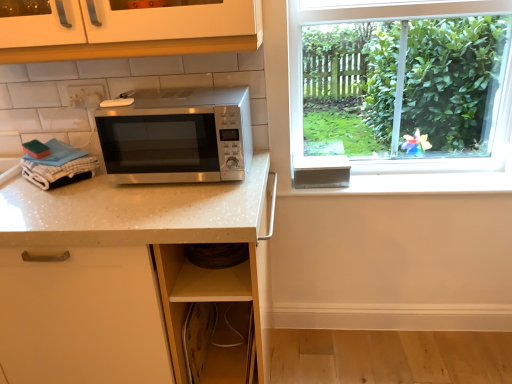
Image resolution: width=512 pixels, height=384 pixels. What are the coordinates of `vacant region in front of satin silver microwave at center` in the screenshot? It's located at (165, 201).